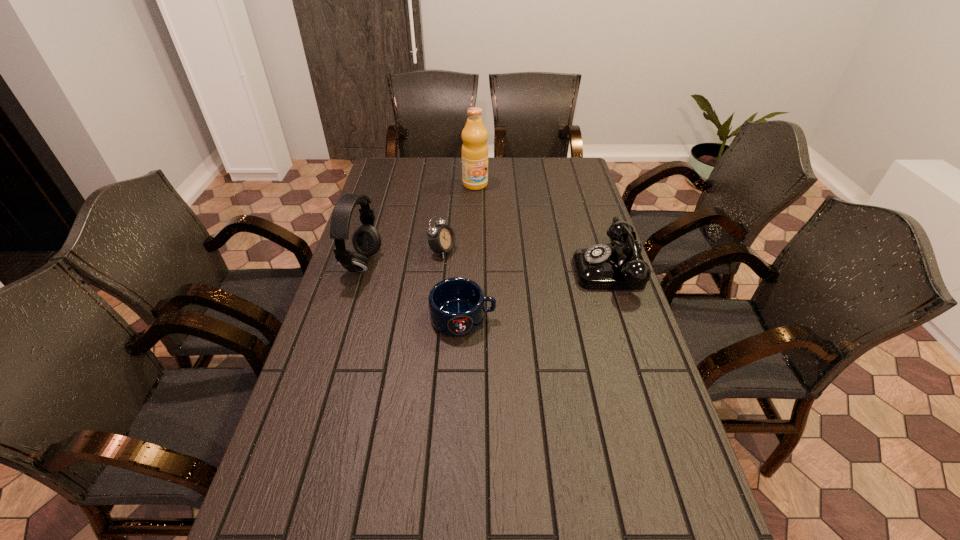
Locate an element on the screen. vacant space on the desktop that is between the shortest object and the telephone and is positioned on the ear cups of the leftmost object is located at coordinates (561, 286).

What are the coordinates of `vacant space on the desktop that is between the mug and the telephone and is positioned on the face of the alarm clock` in the screenshot? It's located at tap(560, 286).

The image size is (960, 540). Find the location of `vacant spot on the desktop that is between the shortest object and the telephone and is positioned on the front label of the farthest object`. vacant spot on the desktop that is between the shortest object and the telephone and is positioned on the front label of the farthest object is located at coordinates (554, 288).